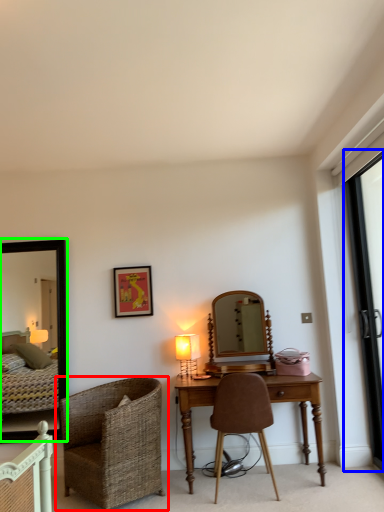
Question: Based on their relative distances, which object is farther from chair (highlighted by a red box)? Choose from screen door (highlighted by a blue box) and mirror (highlighted by a green box).

Choices:
 (A) screen door
 (B) mirror

Answer: (A)